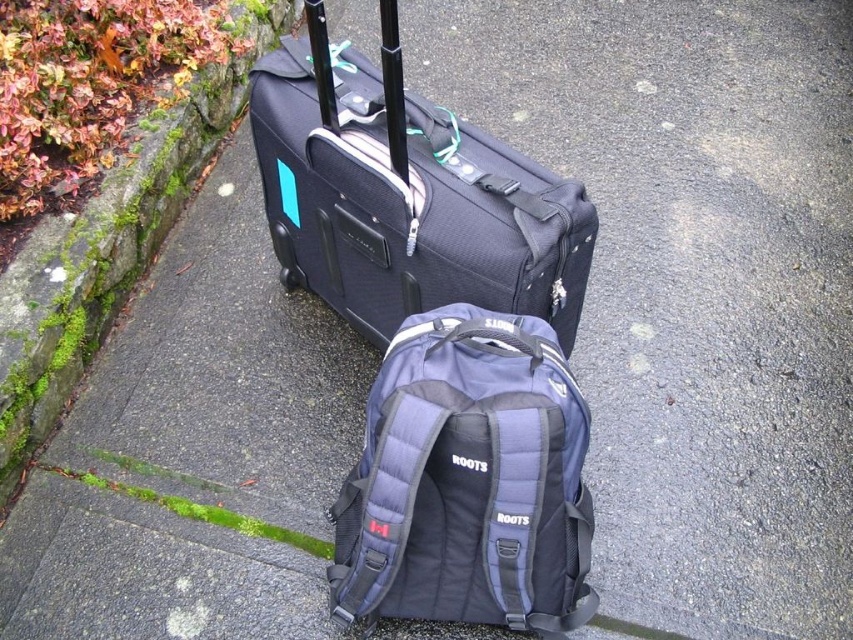
You are a delivery person who needs to move both the matte black suitcase at center and the navy blue fabric backpack at center to a storage room. The storage room has a narrow doorway that is 30 centimeters wide. Can you carry both items through the doorway at the same time without tilting them sideways?

The matte black suitcase at center and navy blue fabric backpack at center are 27.98 centimeters apart from each other. Since the total width of both items combined is less than the 30 centimeter doorway, you can carry both items through the doorway at the same time without tilting them sideways.

You are standing in front of the matte black suitcase at center. You want to pick it up without moving your feet. Can you reach it?

The matte black suitcase at center is 1.01 meters away from viewer, so you cannot reach it without moving your feet because the average arm length is shorter than 1.01 meters.